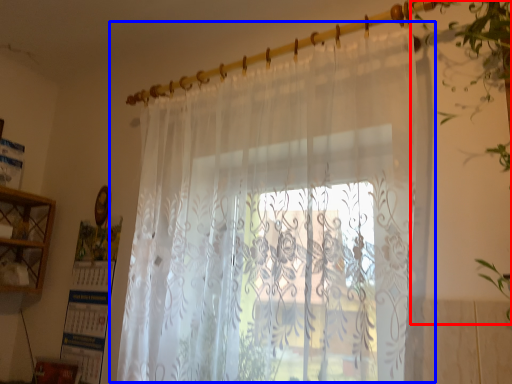
Question: Which object appears farthest to the camera in this image, vegetation (highlighted by a red box) or curtain (highlighted by a blue box)?

Choices:
 (A) vegetation
 (B) curtain

Answer: (B)